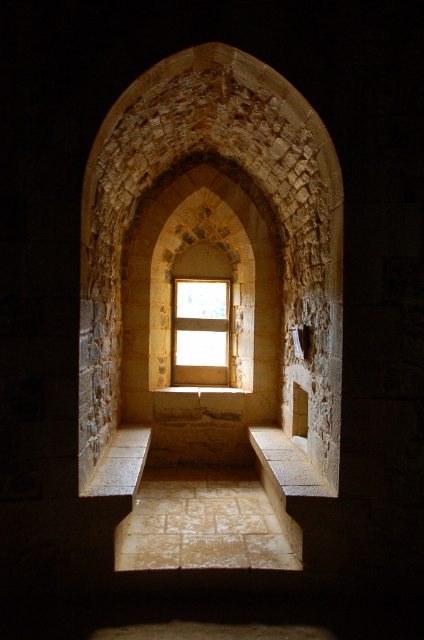
Who is more forward, (x=234, y=237) or (x=201, y=378)?

Point (x=234, y=237)

This screenshot has height=640, width=424. What do you see at coordinates (231, 310) in the screenshot?
I see `stone textured archway at center` at bounding box center [231, 310].

Which is in front, point (245, 392) or point (225, 346)?

Point (245, 392) is in front.

Image resolution: width=424 pixels, height=640 pixels. What are the coordinates of `stone textured archway at center` in the screenshot? It's located at (231, 310).